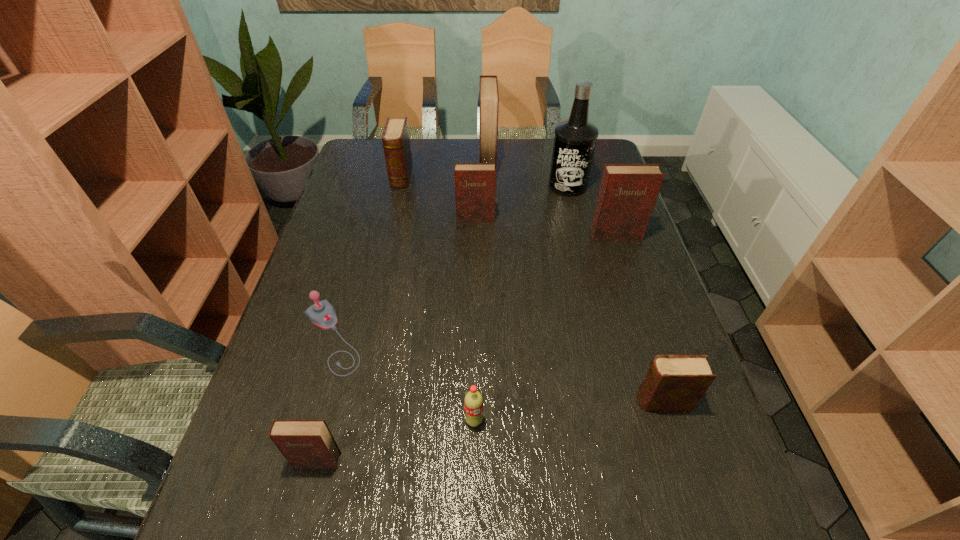
What are the coordinates of `diary that is at the left edge` in the screenshot? It's located at (304, 443).

Where is `joystick situated at the left edge`? The width and height of the screenshot is (960, 540). joystick situated at the left edge is located at coordinates (322, 314).

You are a GUI agent. You are given a task and a screenshot of the screen. Output one action in this format:
    pyautogui.click(x=<x>, y=<y>)
    Task: Click on the liquor that is at the right edge
    This screenshot has height=540, width=960.
    Given the screenshot: What is the action you would take?
    pyautogui.click(x=575, y=139)

What are the coordinates of `vacant point at the left edge` in the screenshot? It's located at (307, 494).

Where is `vacant space at the right edge`? vacant space at the right edge is located at coordinates (619, 361).

Where is `blank space at the far left corner`? The height and width of the screenshot is (540, 960). blank space at the far left corner is located at coordinates (356, 153).

Locate an element on the screen. This screenshot has height=540, width=960. blank space at the near right corner is located at coordinates (732, 531).

Find the location of a particular element. free area in between the leftmost reddish-brown diary and the tallest object is located at coordinates (443, 323).

You are a GUI agent. You are given a task and a screenshot of the screen. Output one action in this format:
    pyautogui.click(x=<x>, y=<y>)
    Task: Click on the free space between the tallest object and the rightmost reddish-brown diary
    The width and height of the screenshot is (960, 540).
    Given the screenshot: What is the action you would take?
    pyautogui.click(x=591, y=211)

Find the location of a particular element. free area in between the farther brown diary and the smaller brown diary is located at coordinates (532, 289).